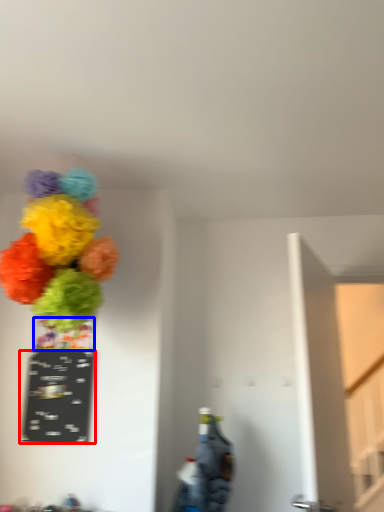
Question: Which point is closer to the camera, writing (highlighted by a red box) or vase (highlighted by a blue box)?

Choices:
 (A) writing
 (B) vase

Answer: (A)